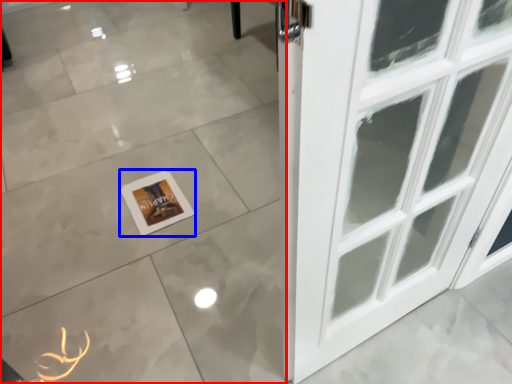
Question: Among these objects, which one is nearest to the camera, ceramic tile (highlighted by a red box) or picture frame (highlighted by a blue box)?

Choices:
 (A) ceramic tile
 (B) picture frame

Answer: (A)